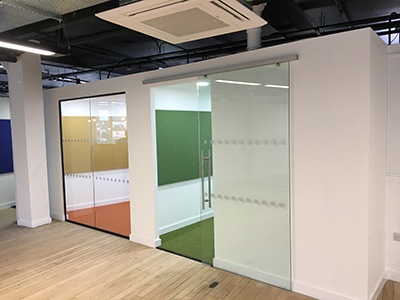
Image resolution: width=400 pixels, height=300 pixels. In order to click on floor in this screenshot , I will do `click(185, 237)`.